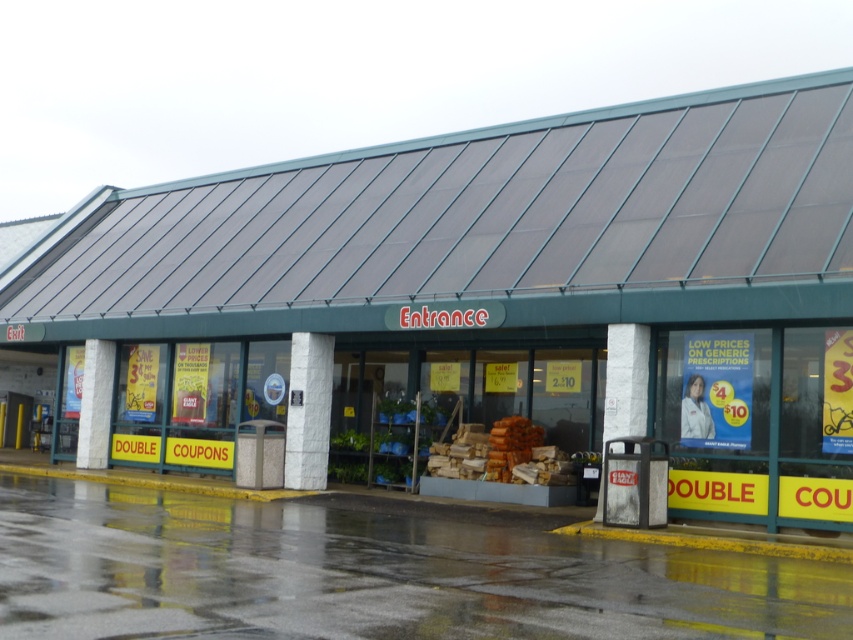
Question: Is green metal entrance at center below white stone pillar at center?

Choices:
 (A) no
 (B) yes

Answer: (A)

Question: Among these objects, which one is nearest to the camera?

Choices:
 (A) white concrete pillar at center
 (B) green metal entrance at center

Answer: (B)

Question: Does green metal entrance at center appear under white concrete pillar at center?

Choices:
 (A) yes
 (B) no

Answer: (B)

Question: Which of these objects is positioned closest to the white textured pillar at center?

Choices:
 (A) white stone pillar at center
 (B) white concrete pillar at center
 (C) green metal entrance at center

Answer: (C)

Question: Can you confirm if green metal entrance at center is thinner than white textured pillar at center?

Choices:
 (A) yes
 (B) no

Answer: (B)

Question: Which object is positioned closest to the green metal entrance at center?

Choices:
 (A) white stone pillar at center
 (B) white textured pillar at center

Answer: (A)